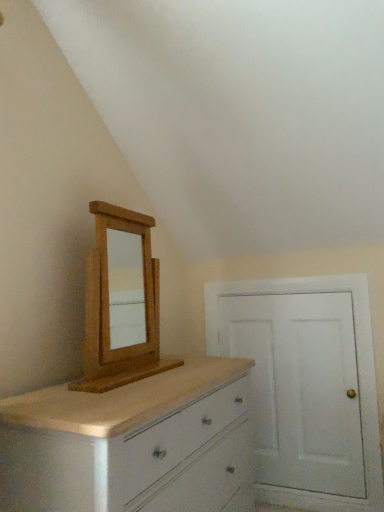
Question: Is white painted wood door at right behind light brown wood medicine cabinet at upper left?

Choices:
 (A) yes
 (B) no

Answer: (A)

Question: Considering the relative sizes of white painted wood door at right and light brown wood medicine cabinet at upper left in the image provided, is white painted wood door at right smaller than light brown wood medicine cabinet at upper left?

Choices:
 (A) no
 (B) yes

Answer: (B)

Question: Can you confirm if white painted wood door at right is shorter than light brown wood medicine cabinet at upper left?

Choices:
 (A) yes
 (B) no

Answer: (B)

Question: From the image's perspective, is white painted wood door at right above light brown wood medicine cabinet at upper left?

Choices:
 (A) no
 (B) yes

Answer: (A)

Question: From a real-world perspective, is white painted wood door at right below light brown wood medicine cabinet at upper left?

Choices:
 (A) yes
 (B) no

Answer: (A)

Question: Is white painted wood door at right next to light brown wood medicine cabinet at upper left and touching it?

Choices:
 (A) yes
 (B) no

Answer: (B)

Question: Does white painted wood chest of drawers at lower left have a greater width compared to light brown wood medicine cabinet at upper left?

Choices:
 (A) yes
 (B) no

Answer: (A)

Question: Is white painted wood chest of drawers at lower left next to light brown wood medicine cabinet at upper left and touching it?

Choices:
 (A) no
 (B) yes

Answer: (A)

Question: Is white painted wood chest of drawers at lower left not within light brown wood medicine cabinet at upper left?

Choices:
 (A) yes
 (B) no

Answer: (A)

Question: From the image's perspective, is white painted wood chest of drawers at lower left beneath light brown wood medicine cabinet at upper left?

Choices:
 (A) no
 (B) yes

Answer: (B)

Question: Is the position of white painted wood chest of drawers at lower left more distant than that of light brown wood medicine cabinet at upper left?

Choices:
 (A) yes
 (B) no

Answer: (B)

Question: From a real-world perspective, is white painted wood chest of drawers at lower left positioned under light brown wood medicine cabinet at upper left based on gravity?

Choices:
 (A) no
 (B) yes

Answer: (B)

Question: Is white painted wood chest of drawers at lower left a part of light brown wood medicine cabinet at upper left?

Choices:
 (A) yes
 (B) no

Answer: (B)